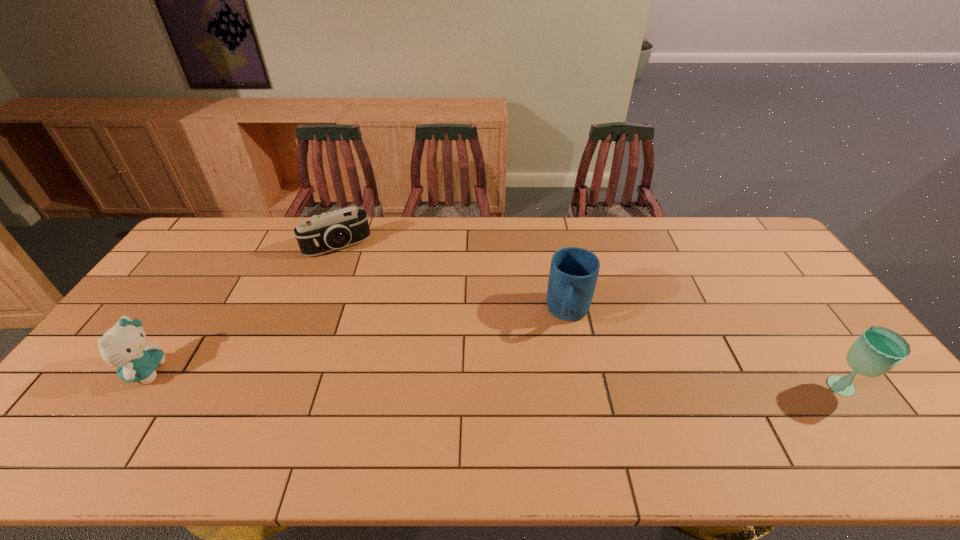
Find the location of `blank space located 0.170m on the front lens of the camera`. blank space located 0.170m on the front lens of the camera is located at coordinates pyautogui.click(x=364, y=288).

Find the location of a particular element. The height and width of the screenshot is (540, 960). free point located on the side of the third object from left to right with the handle is located at coordinates (549, 405).

You are a GUI agent. You are given a task and a screenshot of the screen. Output one action in this format:
    pyautogui.click(x=<x>, y=<y>)
    Task: Click on the vacant point located 0.180m on the side of the third object from left to right with the handle
    The image size is (960, 540).
    Given the screenshot: What is the action you would take?
    pyautogui.click(x=554, y=388)

What are the coordinates of `vacant space located on the side of the third object from left to right with the handle` in the screenshot? It's located at (548, 412).

Where is `object present at the far edge`? The width and height of the screenshot is (960, 540). object present at the far edge is located at coordinates (327, 232).

Find the location of a particular element. kitten located at the near edge is located at coordinates (123, 346).

Find the location of a particular element. This screenshot has width=960, height=540. glass that is at the near edge is located at coordinates (878, 350).

The height and width of the screenshot is (540, 960). I want to click on object that is positioned at the left edge, so click(x=123, y=346).

This screenshot has height=540, width=960. I want to click on object located in the right edge section of the desktop, so click(878, 350).

The image size is (960, 540). Identify the location of object situated at the near left corner. (123, 346).